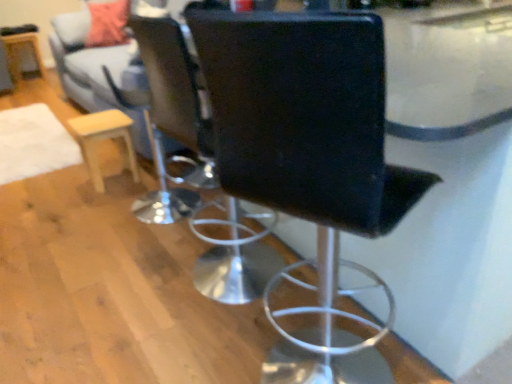
At what (x,y) coordinates should I click in order to perform the action: click on free space in front of light wood/finely finished stool at left. Please return your answer as a coordinate pair (x, y). Image resolution: width=512 pixels, height=384 pixels. Looking at the image, I should click on (98, 201).